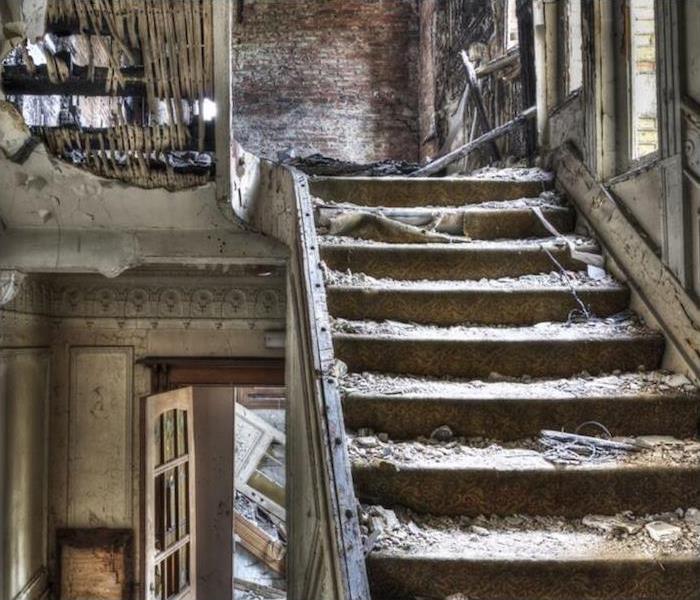
Identify the location of window frame. This screenshot has height=600, width=700. (668, 129), (584, 40), (497, 26).